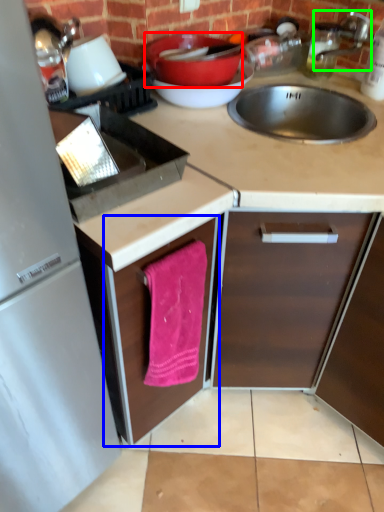
Question: Based on their relative distances, which object is farther from basin (highlighted by a red box)? Choose from cabinetry (highlighted by a blue box) and faucet (highlighted by a green box).

Choices:
 (A) cabinetry
 (B) faucet

Answer: (A)